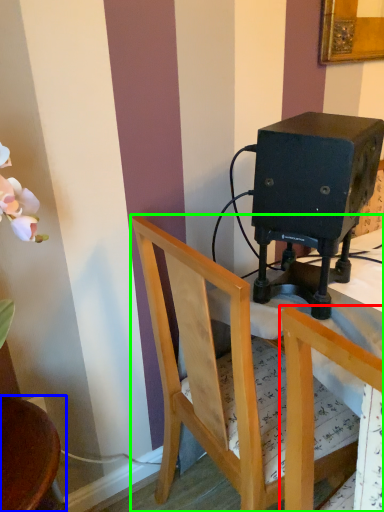
Question: Estimate the real-world distances between objects in this image. Which object is closer to chair (highlighted by a red box), chair (highlighted by a blue box) or chair (highlighted by a green box)?

Choices:
 (A) chair
 (B) chair

Answer: (B)